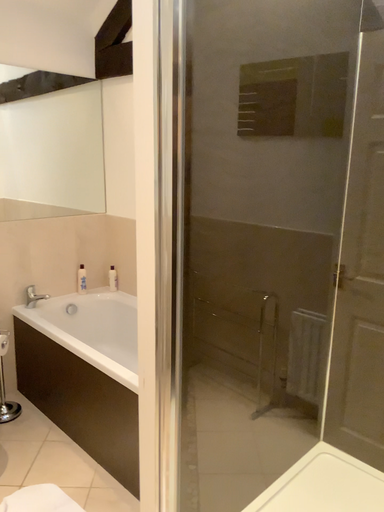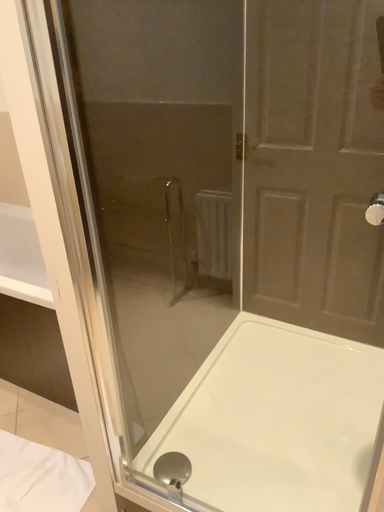
Question: Which way did the camera rotate in the video?

Choices:
 (A) rotated upward
 (B) rotated downward

Answer: (B)